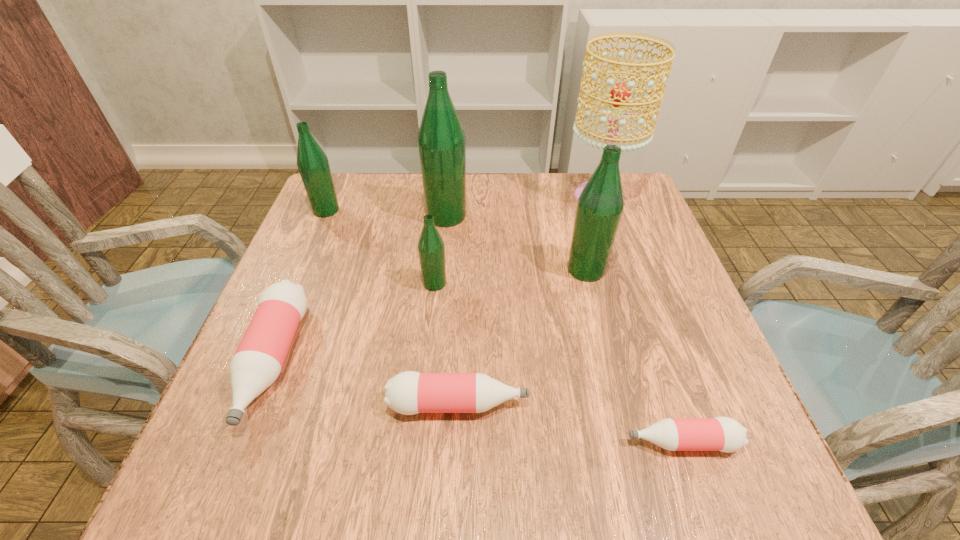
At what (x,y) coordinates should I click in order to perform the action: click on free spot between the fifth tallest object and the fifth tallest bottle. Please return your answer as a coordinate pair (x, y). Looking at the image, I should click on (353, 322).

You are a GUI agent. You are given a task and a screenshot of the screen. Output one action in this format:
    pyautogui.click(x=<x>, y=<y>)
    Task: Click on the free space between the shortest object and the second pink bottle from right to left
    
    Given the screenshot: What is the action you would take?
    pyautogui.click(x=570, y=423)

Where is `vacant area that lies between the tallest bottle and the second pink bottle from right to left`? The image size is (960, 540). vacant area that lies between the tallest bottle and the second pink bottle from right to left is located at coordinates (452, 310).

Identify which object is the seventh nearest to the smallest green bottle. Please provide its 2D coordinates. Your answer should be formatted as a tuple, i.e. [(x, y)], where the tuple contains the x and y coordinates of a point satisfying the conditions above.

[(724, 434)]

Select which object is the closest to the tallest bottle. Please provide its 2D coordinates. Your answer should be formatted as a tuple, i.e. [(x, y)], where the tuple contains the x and y coordinates of a point satisfying the conditions above.

[(431, 249)]

Image resolution: width=960 pixels, height=540 pixels. In order to click on the third closest bottle to the tallest bottle in this screenshot , I will do `click(600, 205)`.

Locate which bottle ranks second in proximity to the second tallest bottle. Please provide its 2D coordinates. Your answer should be formatted as a tuple, i.e. [(x, y)], where the tuple contains the x and y coordinates of a point satisfying the conditions above.

[(431, 249)]

At what (x,y) coordinates should I click in order to perform the action: click on green bottle that can be found as the second closest to the second pink bottle from right to left. Please return your answer as a coordinate pair (x, y). This screenshot has width=960, height=540. Looking at the image, I should click on (600, 205).

The height and width of the screenshot is (540, 960). Find the location of `green bottle that is the closest to the tallest bottle`. green bottle that is the closest to the tallest bottle is located at coordinates (431, 249).

Locate an element on the screen. This screenshot has height=540, width=960. pink bottle that can be found as the third closest to the sixth shortest bottle is located at coordinates (258, 360).